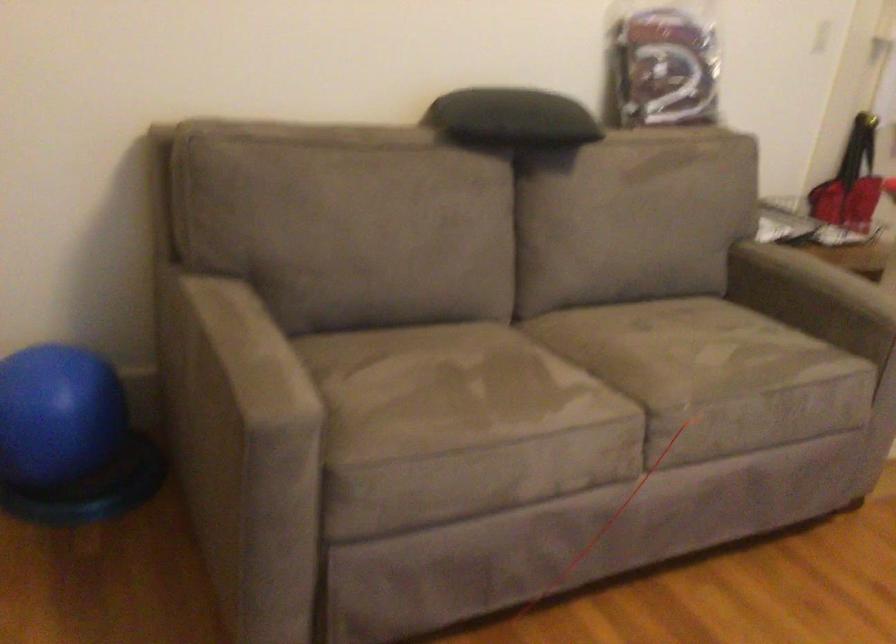
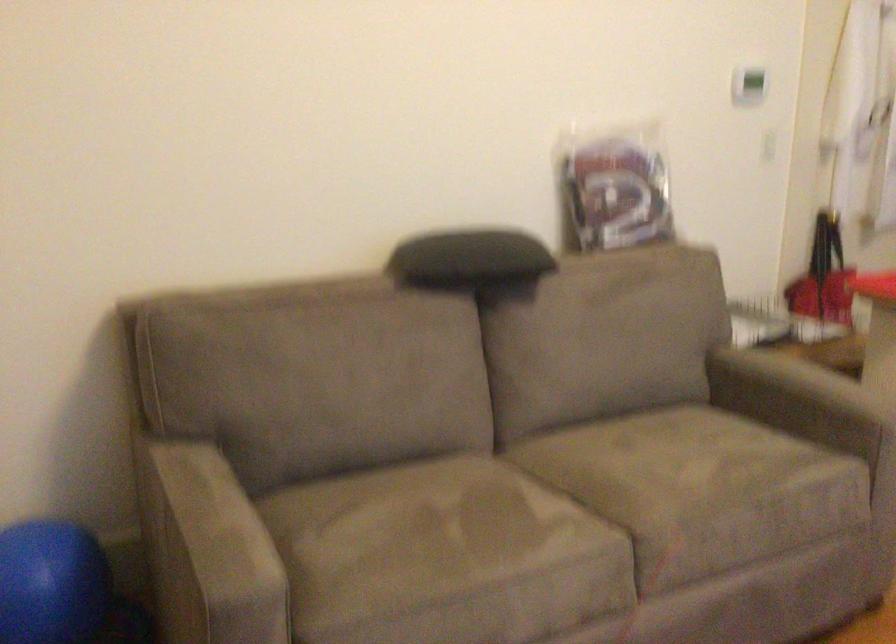
The point at (820, 297) is marked in the first image. Where is the corresponding point in the second image?

(798, 400)